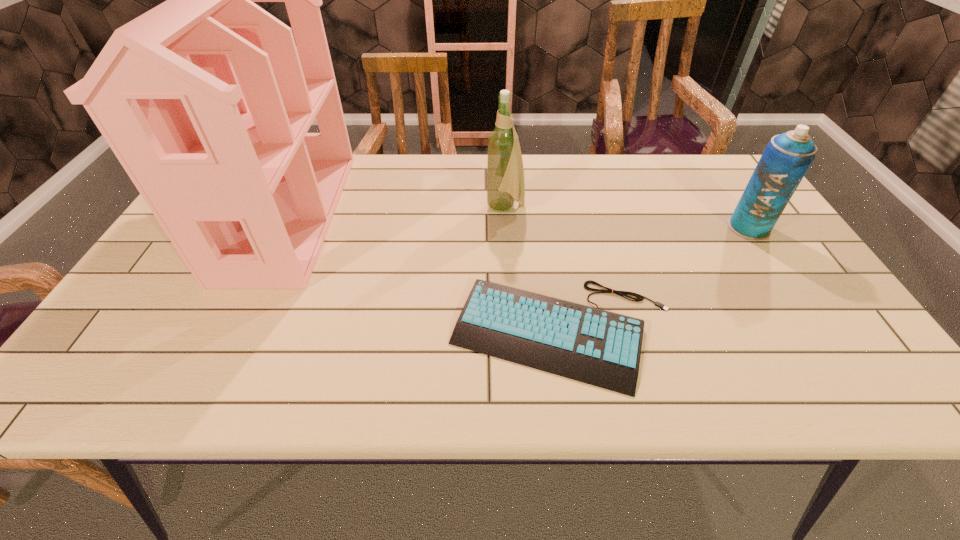
You are a GUI agent. You are given a task and a screenshot of the screen. Output one action in this format:
    pyautogui.click(x=<x>, y=<y>)
    Task: Click on the free space between the wine bottle and the aerosol can
    This screenshot has width=960, height=540.
    Given the screenshot: What is the action you would take?
    pyautogui.click(x=627, y=218)

This screenshot has width=960, height=540. What are the coordinates of `free space between the rightmost object and the computer keyboard` in the screenshot? It's located at (656, 280).

This screenshot has width=960, height=540. Find the location of `the closest object to the aerosol can`. the closest object to the aerosol can is located at coordinates (597, 347).

Point out which object is positioned as the nearest to the computer keyboard. Please provide its 2D coordinates. Your answer should be formatted as a tuple, i.e. [(x, y)], where the tuple contains the x and y coordinates of a point satisfying the conditions above.

[(505, 173)]

Identify the location of blank space that satisfies the following two spatial constraints: 1. on the front-facing side of the dollhouse; 2. on the back side of the computer keyboard. This screenshot has height=540, width=960. click(x=232, y=333).

What are the coordinates of `vacant space that satisfies the following two spatial constraints: 1. on the front-facing side of the shortest object; 2. on the left side of the dollhouse` in the screenshot? It's located at (232, 333).

Find the location of a particular element. free spot that satisfies the following two spatial constraints: 1. on the front-facing side of the shortest object; 2. on the left side of the dollhouse is located at coordinates (232, 333).

The image size is (960, 540). I want to click on free space in the image that satisfies the following two spatial constraints: 1. on the front-facing side of the rightmost object; 2. on the left side of the wine bottle, so click(x=507, y=228).

Identify the location of blank space that satisfies the following two spatial constraints: 1. on the front-facing side of the tallest object; 2. on the left side of the rightmost object. (283, 228).

I want to click on vacant space that satisfies the following two spatial constraints: 1. on the front-facing side of the dollhouse; 2. on the right side of the second shortest object, so click(283, 228).